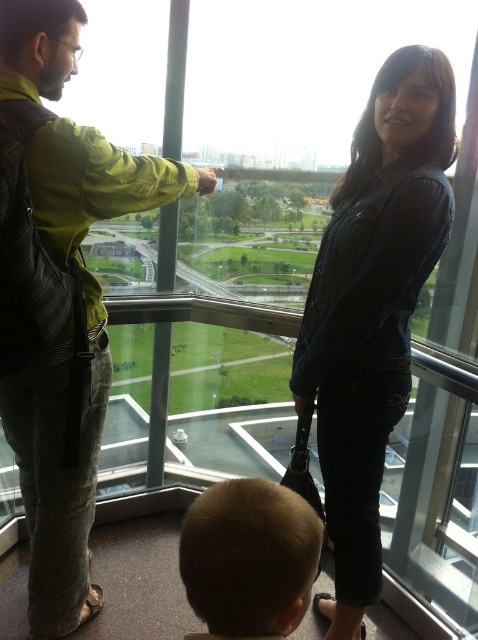
Which is above, green fabric jacket at upper left or blonde hair at lower center?

green fabric jacket at upper left is higher up.

Is green fabric jacket at upper left above blonde hair at lower center?

Indeed, green fabric jacket at upper left is positioned over blonde hair at lower center.

Does point (13, 445) come farther from viewer compared to point (271, 532)?

Yes, point (13, 445) is farther from viewer.

Image resolution: width=478 pixels, height=640 pixels. Identify the location of green fabric jacket at upper left. point(58,296).

Does denim jacket at center appear on the right side of blonde hair at lower center?

Indeed, denim jacket at center is positioned on the right side of blonde hair at lower center.

The image size is (478, 640). I want to click on denim jacket at center, so click(x=372, y=307).

Between green fabric jacket at upper left and denim jacket at center, which one is positioned lower?

denim jacket at center

Measure the distance between point (56, 490) and camera.

1.53 meters

You are a GUI agent. You are given a task and a screenshot of the screen. Output one action in this format:
    pyautogui.click(x=<x>, y=<y>)
    Task: Click on the green fabric jacket at upper left
    This screenshot has height=640, width=478.
    Given the screenshot: What is the action you would take?
    pyautogui.click(x=58, y=296)